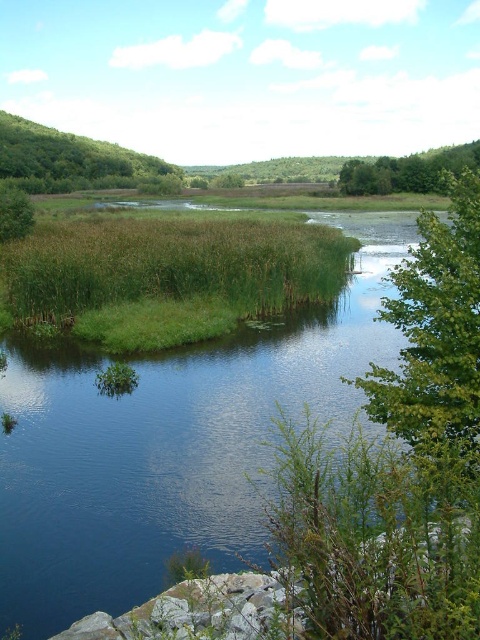
Can you confirm if green grassy river at center is smaller than green leafy tree at left?

No.

Is point (73, 605) closer to viewer compared to point (9, 237)?

Yes, point (73, 605) is in front of point (9, 237).

The width and height of the screenshot is (480, 640). Find the location of `green grassy river at center`. green grassy river at center is located at coordinates (169, 444).

Which is in front, point (470, 465) or point (7, 236)?

Point (470, 465)

Who is more distant from viewer, (x=459, y=397) or (x=16, y=234)?

The point (x=16, y=234) is behind.

Identify the location of green leafy tree at right. The width and height of the screenshot is (480, 640). (436, 342).

Locate an element on the screen. green leafy tree at right is located at coordinates (436, 342).

Which is above, green leafy tree at right or green leafy tree at upper left?

green leafy tree at upper left is higher up.

Which is in front, point (409, 372) or point (134, 152)?

Point (409, 372) is in front.

Image resolution: width=480 pixels, height=640 pixels. Identify the location of green leafy tree at right. (436, 342).